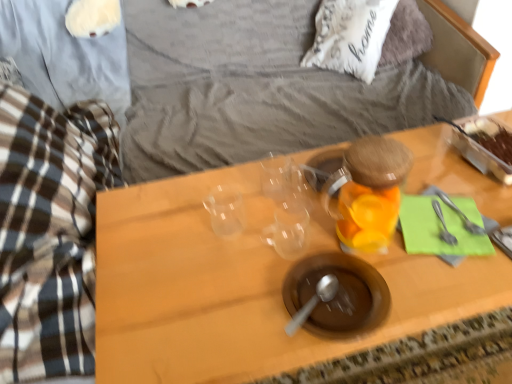
At what (x,y) coordinates should I click in order to perform the action: click on blank space to the left of brown matte bowl at center. Please return your answer as a coordinate pair (x, y). Looking at the image, I should click on (234, 299).